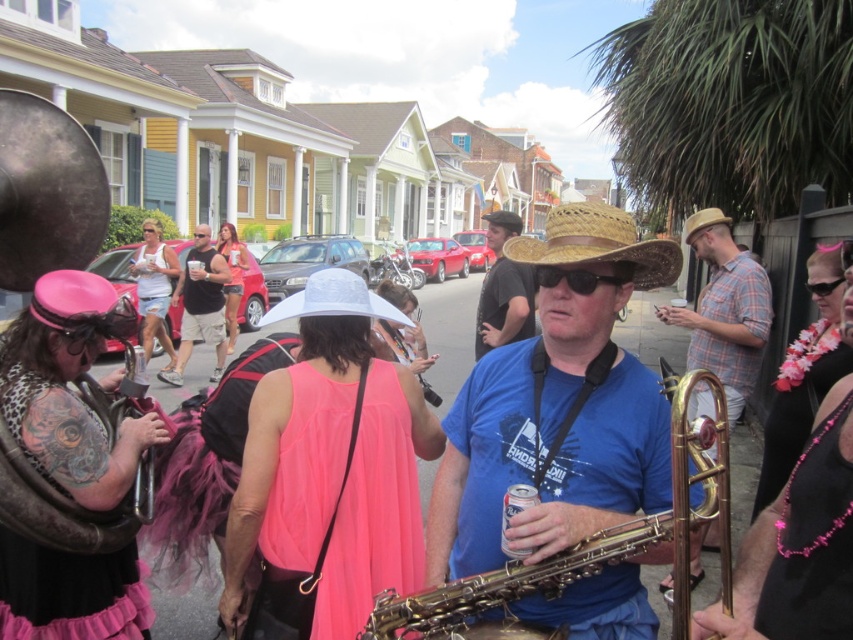
You are a photographer standing at the center of the street. You want to take a picture of the pink beaded lei at right. Which direction should you turn your camera to capture it?

The pink beaded lei at right is located at point (x=798, y=406), so you should turn your camera to the right to capture it.

Looking at this image, you are a photographer at the event and want to capture a photo of the pink chiffon dress at center. The camera is set to focus at point 0.8 on the horizontal axis and 0.4 on the vertical axis. Will the dress be in focus?

The pink chiffon dress at center is positioned at point 0.830 on the horizontal axis and 0.402 on the vertical axis. The camera is focused at 0.8 horizontally and 0.4 vertically. The slight difference in coordinates means the dress is very close to the focus point, so it should be in focus.

In the scene shown: You are a photographer at the event and want to capture both the blue fabric shirt at center and the pink chiffon dress at center in a single frame. Since the camera has a limited focus range, which clothing item should you prioritize to ensure it is in focus if you can only focus on one?

The blue fabric shirt at center is larger in size compared to the pink chiffon dress at center, so prioritizing the blue fabric shirt at center would ensure it is in focus as it occupies more space in the frame.